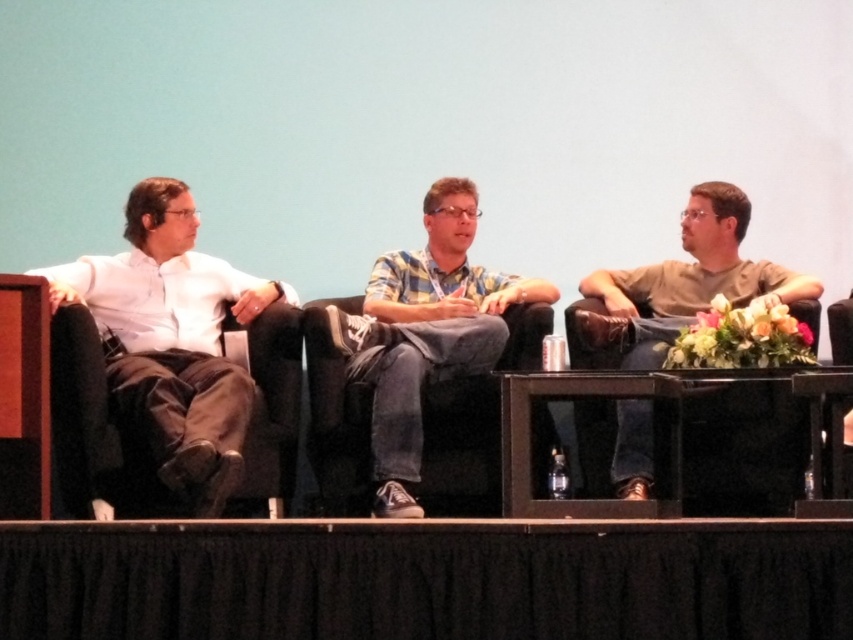
You are a photographer setting up for a group photo. You need to ensure that all subjects are visible. Given that the white matte shirt at left and brown cotton shirt at right are seated, which person should you adjust to be more forward to maintain visibility?

The brown cotton shirt at right should be adjusted to sit forward since it is shorter in height compared to the white matte shirt at left, ensuring both are visible in the photo.

Based on the scene description, which individual has a narrower torso? The white matte shirt at left or the plaid shirt at center?

The white matte shirt at left has a narrower torso than the plaid shirt at center because the description states that the white matte shirt at left is less wide than the plaid shirt at center.

You are an event photographer trying to capture a group photo of the plaid shirt at center and brown cotton shirt at right. Since you want to maintain their current positions, where should you position yourself relative to them?

You should position yourself to the left of the plaid shirt at center and brown cotton shirt at right because the plaid shirt at center is to the left of brown cotton shirt at right, so standing to their left would allow you to capture both in frame while maintaining their positions.